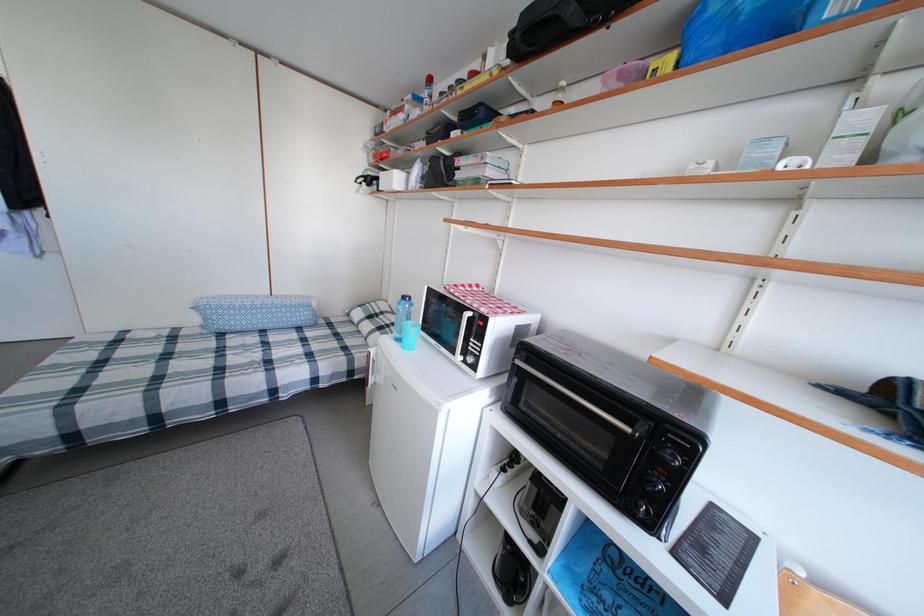
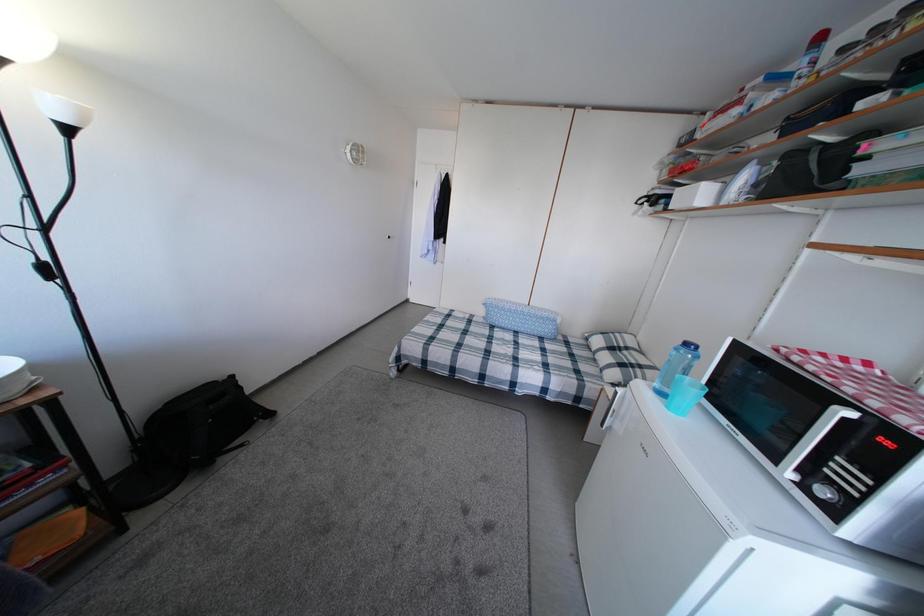
Question: The camera is either moving clockwise (left) or counter-clockwise (right) around the object. The first image is from the beginning of the video and the second image is from the end. Is the camera moving left or right when shooting the video?

Choices:
 (A) Left
 (B) Right

Answer: (B)